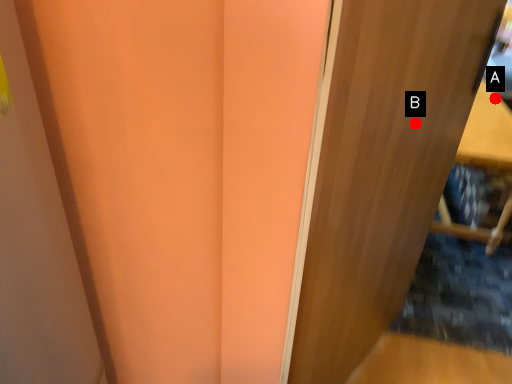
Question: Two points are circled on the image, labeled by A and B beside each circle. Which point is further to the camera?

Choices:
 (A) A is further
 (B) B is further

Answer: (A)